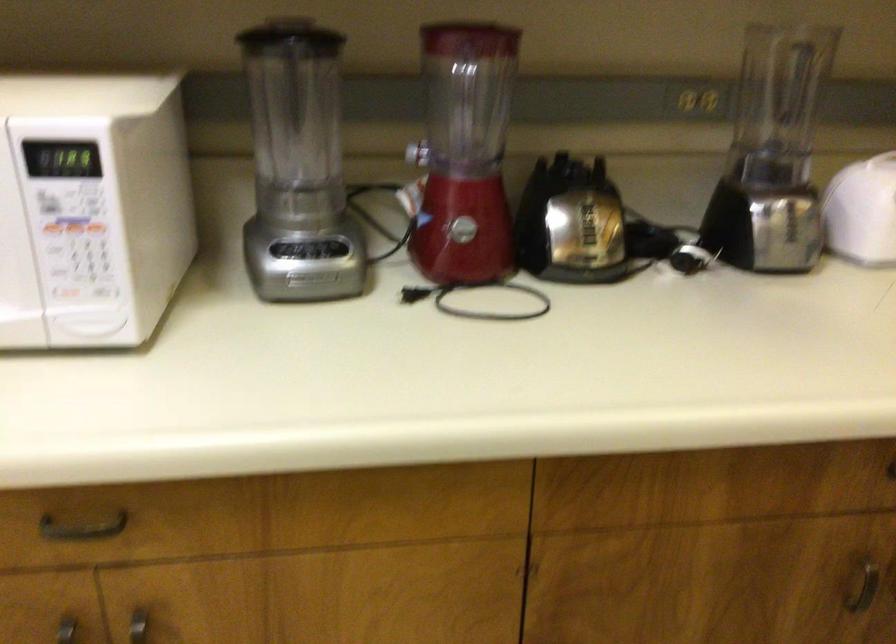
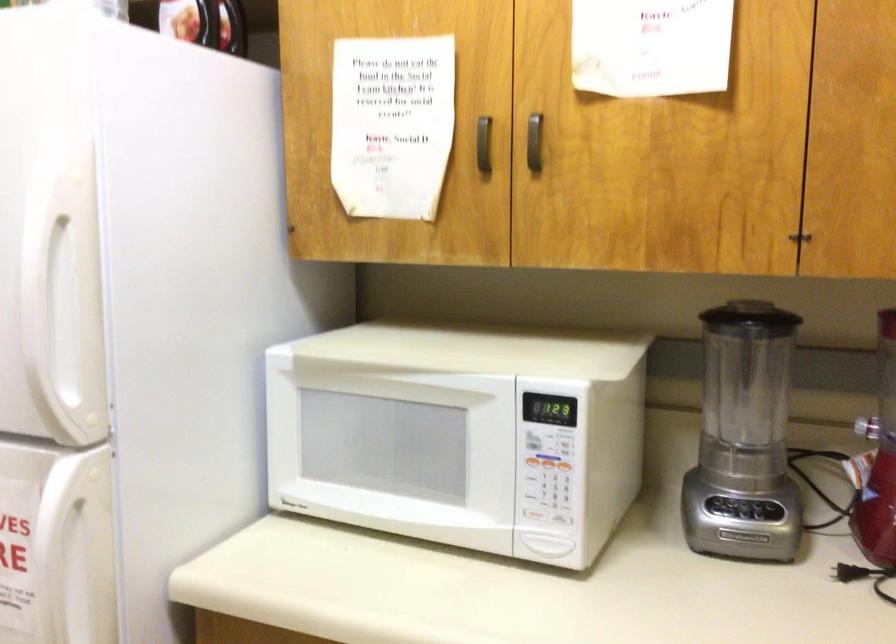
Question: The first image is from the beginning of the video and the second image is from the end. How did the camera likely rotate when shooting the video?

Choices:
 (A) Left
 (B) Right
 (C) Up
 (D) Down

Answer: (A)